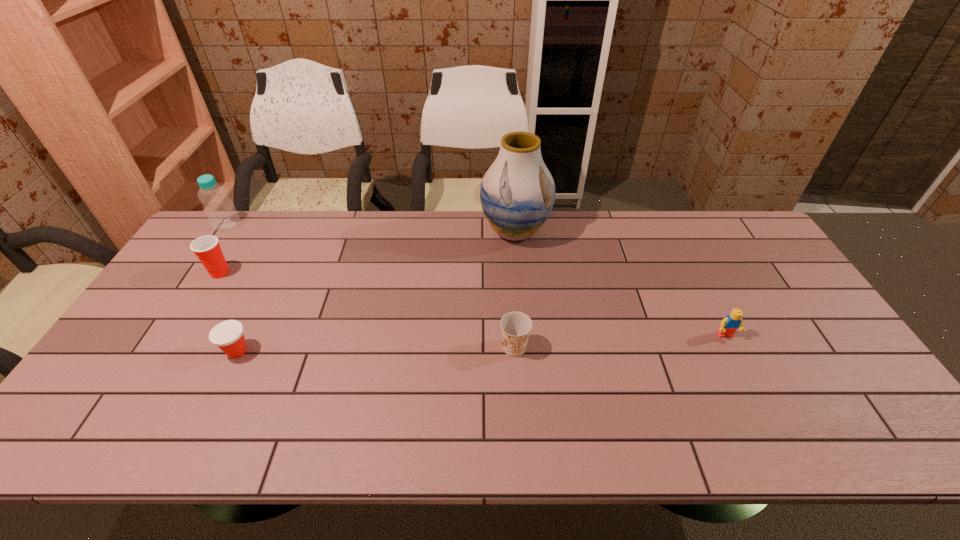
This screenshot has height=540, width=960. Find the location of `vacant area situated 0.320m on the front of the fourth nearest object`. vacant area situated 0.320m on the front of the fourth nearest object is located at coordinates (160, 370).

This screenshot has width=960, height=540. Identify the location of vacant point located 0.130m on the front-facing side of the Lego. (749, 383).

The width and height of the screenshot is (960, 540). Find the location of `blank area located on the left of the second tallest Dixie cup`. blank area located on the left of the second tallest Dixie cup is located at coordinates (381, 347).

Identify the location of vacant space located on the front of the shortest Dixie cup. (207, 414).

What are the coordinates of `vase that is at the far edge` in the screenshot? It's located at (517, 193).

Where is `bottle that is at the far edge`? bottle that is at the far edge is located at coordinates pos(219,209).

Identify the location of bottle that is at the left edge. (219, 209).

Find the location of `Dixie cup that is at the left edge`. Dixie cup that is at the left edge is located at coordinates pos(207,248).

The height and width of the screenshot is (540, 960). In order to click on object that is at the far left corner in this screenshot , I will do `click(219, 209)`.

At what (x,y) coordinates should I click in order to perform the action: click on vacant position at the far edge of the desktop. Please return your answer as a coordinate pair (x, y). The height and width of the screenshot is (540, 960). Looking at the image, I should click on (475, 254).